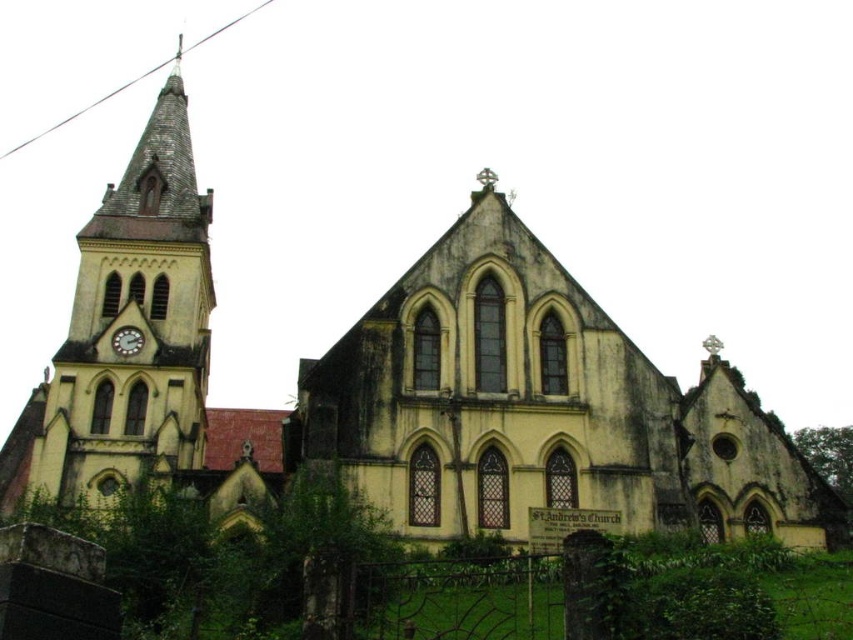
You are standing in front of the historic church and notice the yellow stone clock tower at left and the metallic clock at left. Which of these two objects is positioned more to the left side of the church?

The yellow stone clock tower at left is positioned more to the left side of the church compared to the metallic clock at left.

You are standing in front of the historic church and notice the yellow stone clock tower at left and the metallic clock at left. Which object is higher up from the ground?

The yellow stone clock tower at left is positioned over the metallic clock at left, so the yellow stone clock tower at left is higher up from the ground.

You are standing in front of the historic church and want to determine the relative positions of two points marked on the tower. Which point is closer to you, point 1 at coordinates (22, 433) or point 2 at coordinates (134, 337)?

Point 1 at coordinates (22, 433) is closer to you because it is further to the viewer than point 2 at coordinates (134, 337).